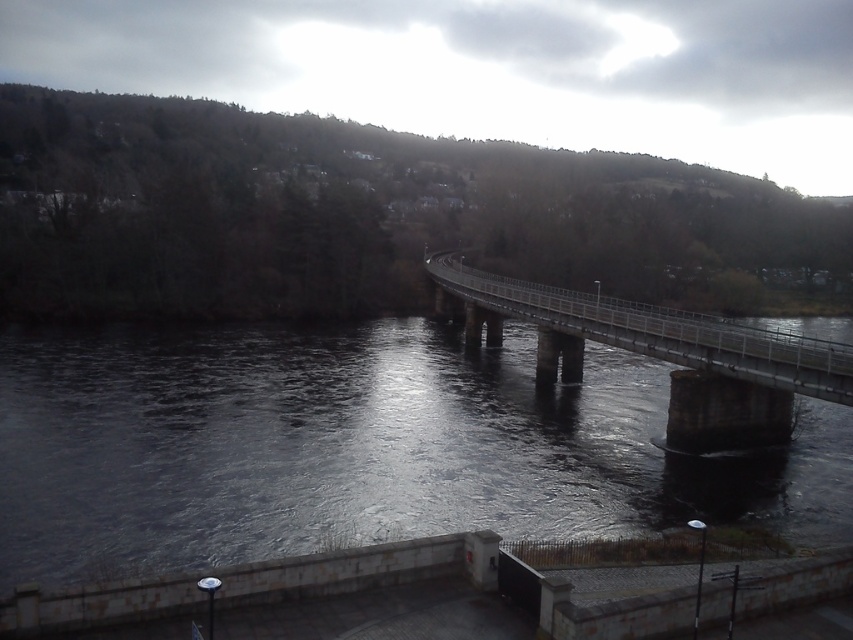
You are a construction inspector tasked with ensuring safety standards are met. You need to check if the distance between the dark gray concrete river at center and the metallic gray bridge at center meets the required 60 feet clearance. Based on the scene provided, does it comply?

The dark gray concrete river at center and metallic gray bridge at center are 58.50 feet apart, which is less than the required 60 feet clearance. Therefore, it does not comply with the safety standards.

You are a pedestrian trying to cross the river using the bridge. Based on the scene, can you determine if the metallic gray bridge at center is wide enough to safely walk across the dark gray concrete river at center?

The dark gray concrete river at center might be wider than metallic gray bridge at center, so there is a possibility that the bridge is not wide enough to safely cross the river. It is recommended to check the actual width before proceeding.

You are standing on the riverside path and want to cross the river using the bridge. According to the scene, which object is closer to you as you face the river? The dark gray concrete river at center or the metallic gray bridge at center?

The dark gray concrete river at center is closer to you because it is positioned in front of the metallic gray bridge at center.